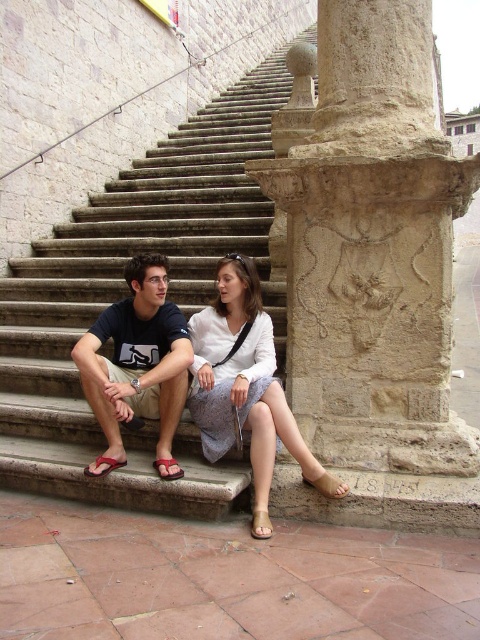
Question: Which of the following is the closest to the observer?

Choices:
 (A) (146, 307)
 (B) (337, 488)
 (C) (196, 307)

Answer: (B)

Question: Does stone textured column at right come behind light blue fabric dress at center?

Choices:
 (A) yes
 (B) no

Answer: (A)

Question: Which of the following is the farthest from the observer?

Choices:
 (A) stone textured column at right
 (B) dark blue t-shirt at lower center
 (C) stone stairs at center
 (D) light blue fabric dress at center

Answer: (B)

Question: Which point is closer to the camera?

Choices:
 (A) (192, 259)
 (B) (396, 275)
 (C) (265, 364)

Answer: (B)

Question: Is stone stairs at center thinner than dark blue t-shirt at lower center?

Choices:
 (A) no
 (B) yes

Answer: (A)

Question: Does stone stairs at center appear on the left side of dark blue t-shirt at lower center?

Choices:
 (A) yes
 (B) no

Answer: (A)